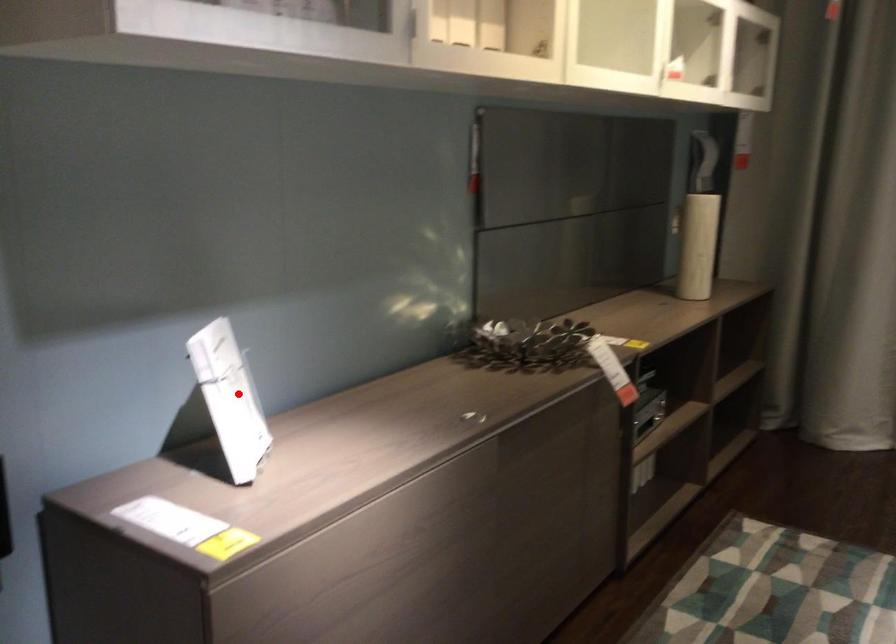
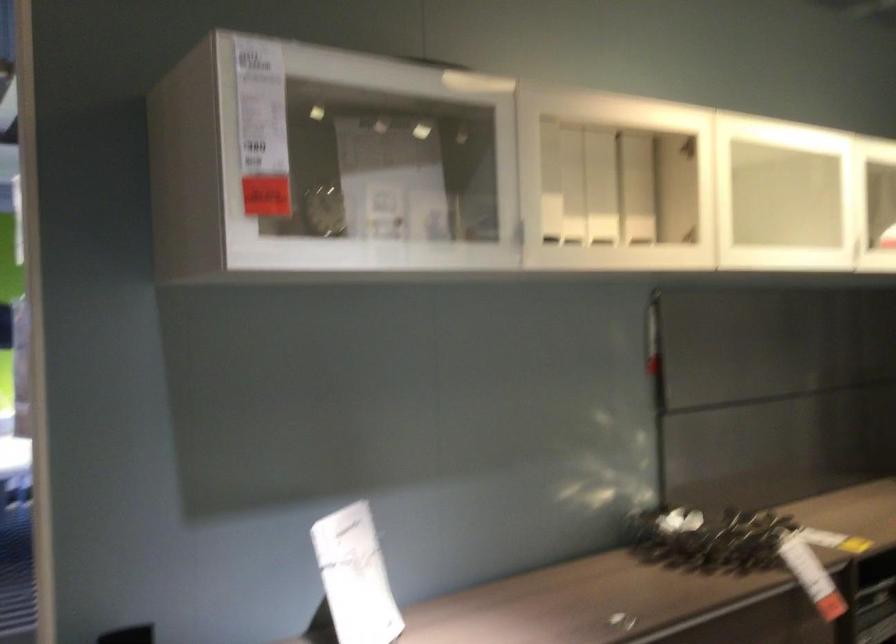
Locate, in the second image, the point that corresponds to the highlighted location in the first image.

(355, 576)